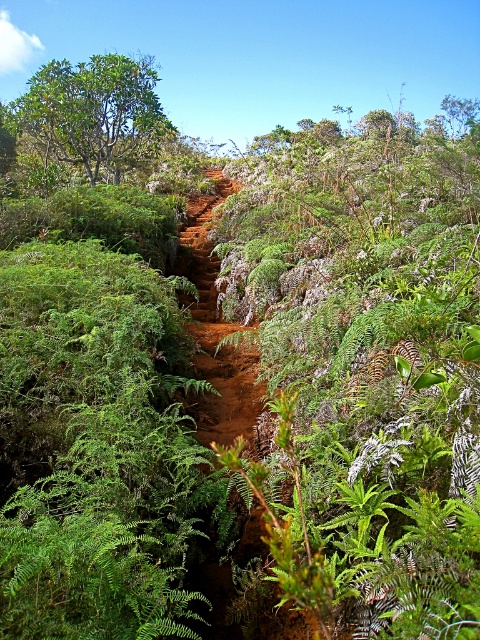
Consider the image. Is brown earthy trail at center to the right of green leafy tree at upper left from the viewer's perspective?

Correct, you'll find brown earthy trail at center to the right of green leafy tree at upper left.

Does point (213, 285) come closer to viewer compared to point (93, 161)?

That is True.

What are the coordinates of `brown earthy trail at center` in the screenshot? It's located at (216, 330).